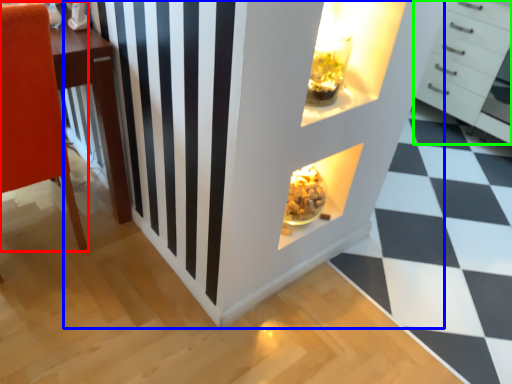
Question: Considering the real-world distances, which object is farthest from furniture (highlighted by a red box)? dresser (highlighted by a blue box) or chest of drawers (highlighted by a green box)?

Choices:
 (A) dresser
 (B) chest of drawers

Answer: (B)